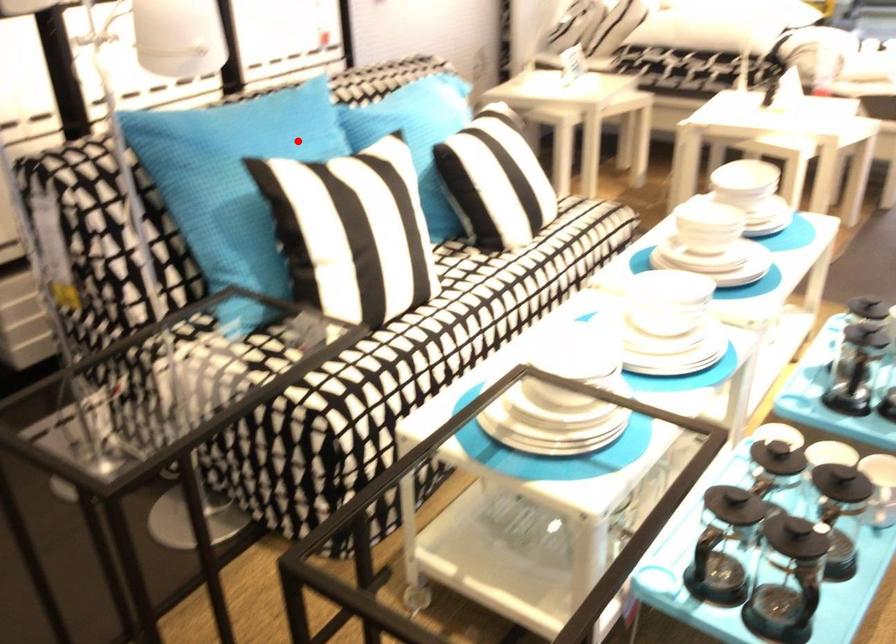
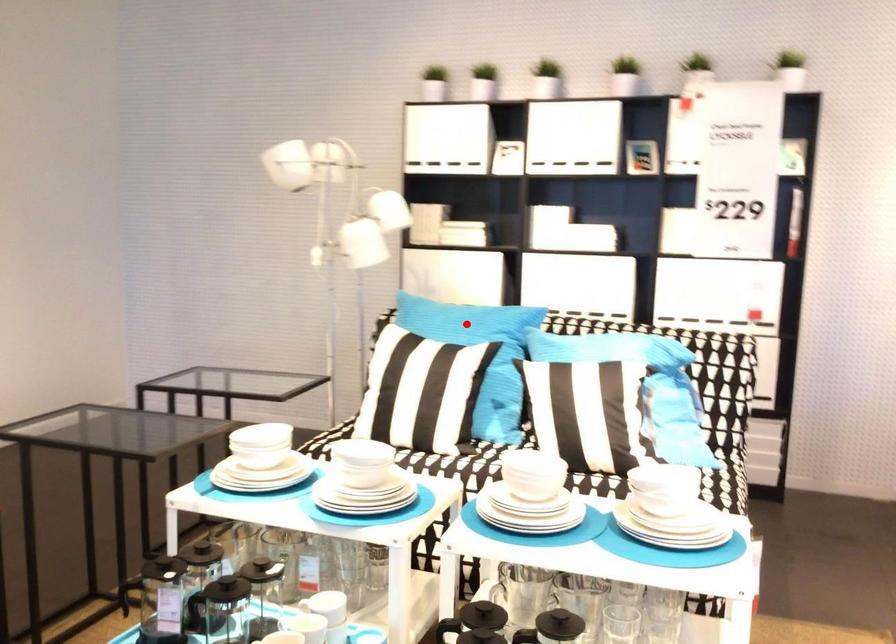
I am providing you with two images of the same scene from different viewpoints. A red point is marked on the first image and another point is marked on the second image. Is the marked point in image1 the same physical position as the marked point in image2?

Yes